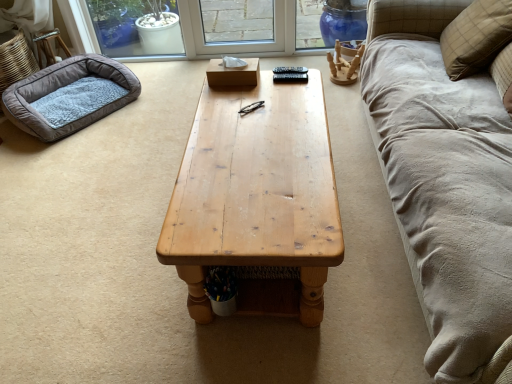
Question: Can you confirm if beige plaid pillow at upper right is taller than soft gray fleece dog bed at left?

Choices:
 (A) no
 (B) yes

Answer: (B)

Question: From the image's perspective, is beige plaid pillow at upper right located beneath soft gray fleece dog bed at left?

Choices:
 (A) yes
 (B) no

Answer: (B)

Question: Is beige plaid pillow at upper right at the left side of soft gray fleece dog bed at left?

Choices:
 (A) yes
 (B) no

Answer: (B)

Question: Would you say beige plaid pillow at upper right is outside soft gray fleece dog bed at left?

Choices:
 (A) no
 (B) yes

Answer: (B)

Question: Can you confirm if beige plaid pillow at upper right is smaller than soft gray fleece dog bed at left?

Choices:
 (A) yes
 (B) no

Answer: (B)

Question: Considering the relative positions of wooden tissue box at center and natural wood coffee table at center in the image provided, is wooden tissue box at center to the left or to the right of natural wood coffee table at center?

Choices:
 (A) left
 (B) right

Answer: (A)

Question: Is wooden tissue box at center in front of or behind natural wood coffee table at center in the image?

Choices:
 (A) front
 (B) behind

Answer: (B)

Question: Based on their sizes in the image, would you say wooden tissue box at center is bigger or smaller than natural wood coffee table at center?

Choices:
 (A) big
 (B) small

Answer: (B)

Question: From the image's perspective, relative to natural wood coffee table at center, is wooden tissue box at center above or below?

Choices:
 (A) above
 (B) below

Answer: (A)

Question: Is beige plaid pillow at upper right to the left or to the right of natural wood coffee table at center in the image?

Choices:
 (A) right
 (B) left

Answer: (A)

Question: Considering the positions of beige plaid pillow at upper right and natural wood coffee table at center in the image, is beige plaid pillow at upper right wider or thinner than natural wood coffee table at center?

Choices:
 (A) wide
 (B) thin

Answer: (B)

Question: From a real-world perspective, is beige plaid pillow at upper right above or below natural wood coffee table at center?

Choices:
 (A) below
 (B) above

Answer: (B)

Question: Is point (498, 13) closer or farther from the camera than point (250, 195)?

Choices:
 (A) farther
 (B) closer

Answer: (A)

Question: From the image's perspective, is soft gray fleece dog bed at left above or below beige plaid pillow at upper right?

Choices:
 (A) above
 (B) below

Answer: (B)

Question: Is soft gray fleece dog bed at left in front of or behind beige plaid pillow at upper right in the image?

Choices:
 (A) front
 (B) behind

Answer: (B)